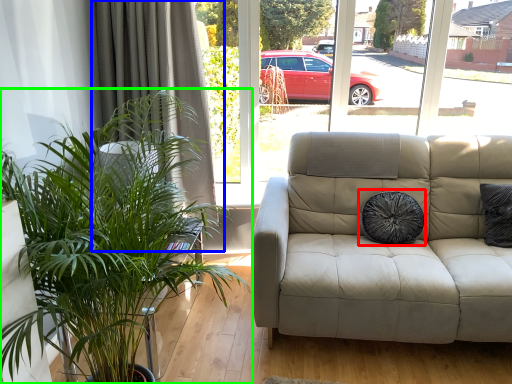
Question: Which object is positioned farthest from pillow (highlighted by a red box)? Select from curtain (highlighted by a blue box) and houseplant (highlighted by a green box).

Choices:
 (A) curtain
 (B) houseplant

Answer: (B)